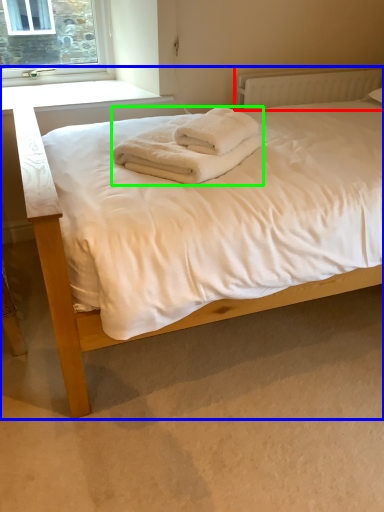
Question: Based on their relative distances, which object is farther from radiator (highlighted by a red box)? Choose from bed (highlighted by a blue box) and bath towel (highlighted by a green box).

Choices:
 (A) bed
 (B) bath towel

Answer: (A)